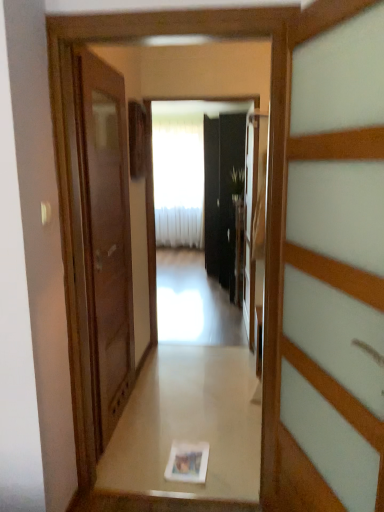
Question: From a real-world perspective, is glossy black mirror at center beneath wooden door at right, acting as the first door starting from the front?

Choices:
 (A) yes
 (B) no

Answer: (B)

Question: Does glossy black mirror at center have a greater width compared to wooden door at right, acting as the first door starting from the front?

Choices:
 (A) no
 (B) yes

Answer: (A)

Question: Is glossy black mirror at center oriented towards wooden door at right, acting as the first door starting from the front?

Choices:
 (A) yes
 (B) no

Answer: (A)

Question: Does glossy black mirror at center have a larger size compared to wooden door at right, which ranks as the 2th door in back-to-front order?

Choices:
 (A) no
 (B) yes

Answer: (A)

Question: Is glossy black mirror at center smaller than wooden door at right, which ranks as the 2th door in back-to-front order?

Choices:
 (A) no
 (B) yes

Answer: (B)

Question: Does glossy black mirror at center have a lesser width compared to wooden door at right, the 1th door viewed from the right?

Choices:
 (A) yes
 (B) no

Answer: (A)

Question: Is matte brown door at left, which is the 2th door in front-to-back order, far from black glass screen door at center?

Choices:
 (A) yes
 (B) no

Answer: (A)

Question: From a real-world perspective, is matte brown door at left, which ranks as the second door in right-to-left order, located higher than black glass screen door at center?

Choices:
 (A) no
 (B) yes

Answer: (A)

Question: Is matte brown door at left, arranged as the 1th door when viewed from the back, oriented away from black glass screen door at center?

Choices:
 (A) yes
 (B) no

Answer: (B)

Question: Considering the relative sizes of matte brown door at left, the 1th door when ordered from left to right, and black glass screen door at center in the image provided, is matte brown door at left, the 1th door when ordered from left to right, thinner than black glass screen door at center?

Choices:
 (A) no
 (B) yes

Answer: (B)

Question: Can you confirm if matte brown door at left, arranged as the 1th door when viewed from the back, is smaller than black glass screen door at center?

Choices:
 (A) yes
 (B) no

Answer: (A)

Question: From the image's perspective, is matte brown door at left, arranged as the 1th door when viewed from the back, on black glass screen door at center?

Choices:
 (A) no
 (B) yes

Answer: (A)

Question: Is glossy black mirror at center to the left of black glass screen door at center from the viewer's perspective?

Choices:
 (A) no
 (B) yes

Answer: (B)